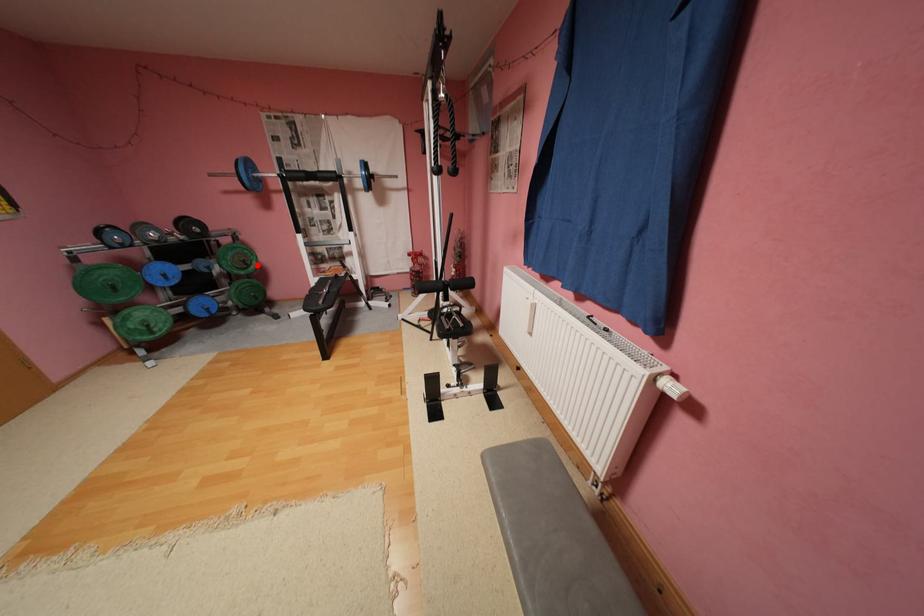
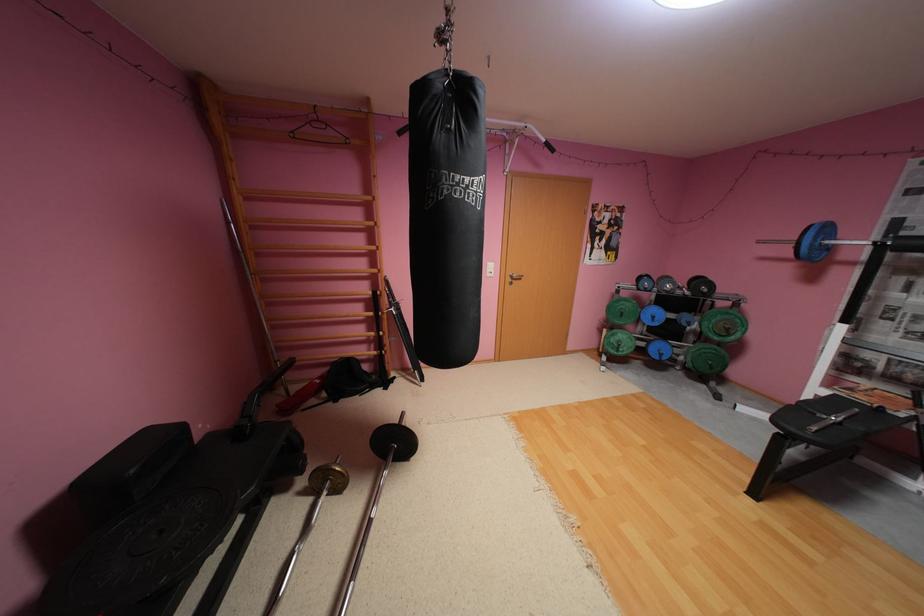
Question: I am providing you with two images of the same scene from different viewpoints. In image1, a red point is highlighted. Considering the same 3D point in image2, which of the following is correct?

Choices:
 (A) It is closer
 (B) It is farther

Answer: (B)